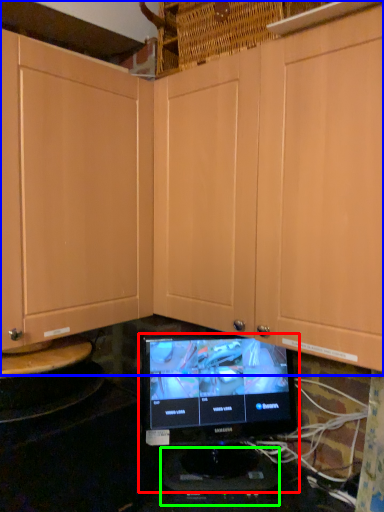
Question: Which object is the farthest from computer monitor (highlighted by a red box)? Choose among these: cabinetry (highlighted by a blue box) or appliance (highlighted by a green box).

Choices:
 (A) cabinetry
 (B) appliance

Answer: (A)